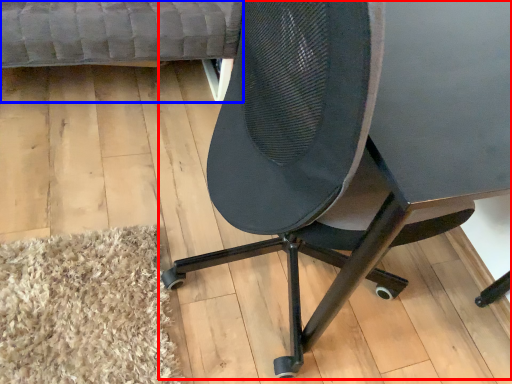
Question: Which object appears farthest to the camera in this image, chair (highlighted by a red box) or couch (highlighted by a blue box)?

Choices:
 (A) chair
 (B) couch

Answer: (B)